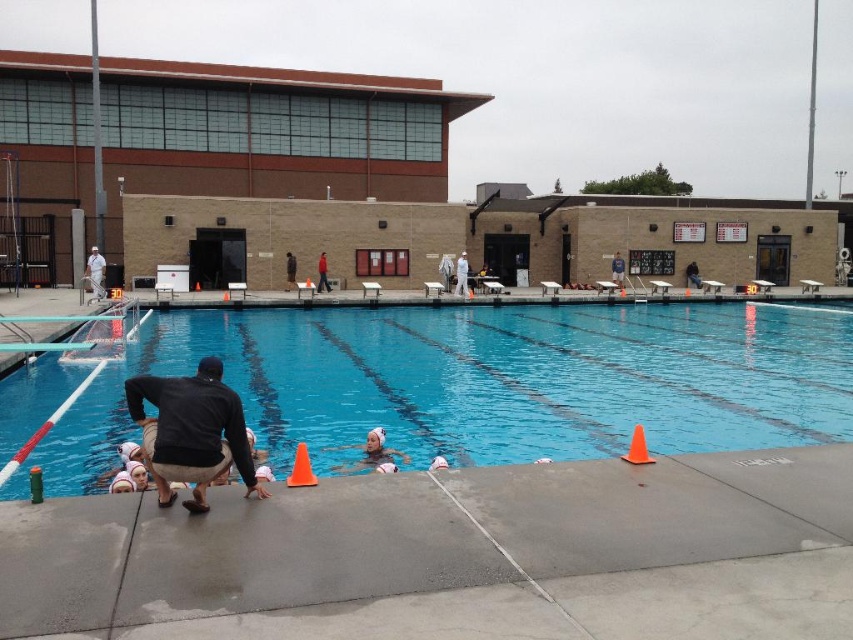
You are a photographer standing on the pool deck. You want to capture a photo that includes both the white matte uniform at center and the blue fabric shirt at center. What is the minimum distance you need to move backward to ensure both are in frame?

The white matte uniform at center and blue fabric shirt at center are 26.72 feet apart. To include both in the frame, you need to move back at least 26.72 feet from the closest object to ensure the entire distance between them fits within the camera view.

You are a photographer setting up a shot at the poolside. You need to ensure that the blue fabric shirt at center is fully visible in the frame without being blocked by the concrete at lower center. Based on the scene description, can you confirm if this is possible?

The concrete at lower center is wider than the blue fabric shirt at center. Since the concrete is wider, it might block part of the shirt unless positioned carefully. Adjust your angle to avoid overlap.